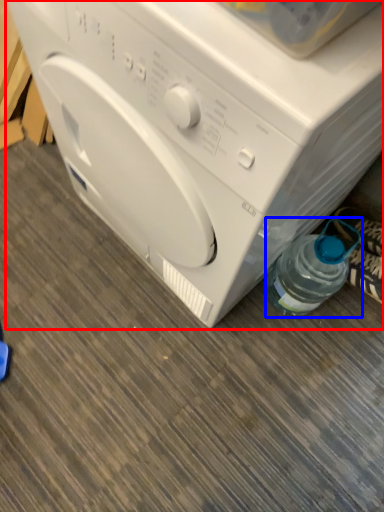
Question: Among these objects, which one is nearest to the camera, washing machine (highlighted by a red box) or bottle (highlighted by a blue box)?

Choices:
 (A) washing machine
 (B) bottle

Answer: (A)